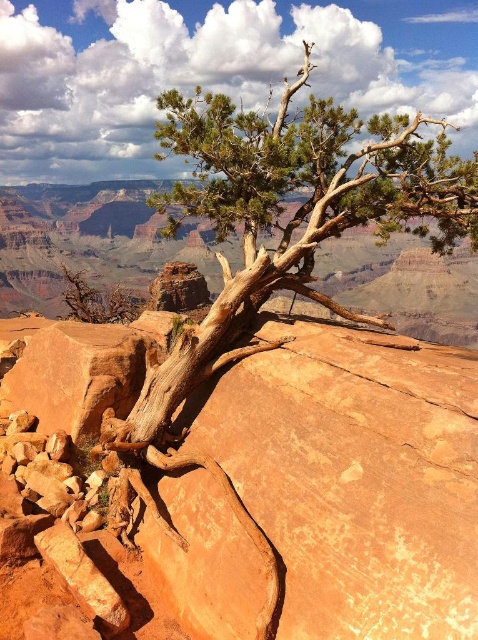
You are a geologist examining the Grand Canyon landscape. You notice the orange rough rock at center and the brown rough bark tree at center. Which object takes up more area in the image?

The brown rough bark tree at center occupies more space than the orange rough rock at center according to the description.

You are a hiker standing at the edge of the Grand Canyon and see the orange rough rock at center and the brown rough bark tree at center. Which object is positioned to the left when viewed from your perspective?

The orange rough rock at center is positioned to the left of the brown rough bark tree at center.